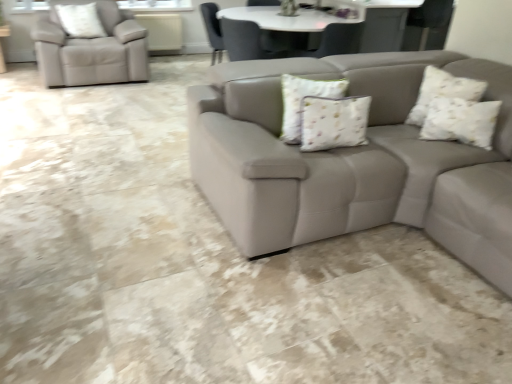
What do you see at coordinates (461, 121) in the screenshot?
I see `white textured pillow at upper right, acting as the 2th pillow starting from the front` at bounding box center [461, 121].

At what (x,y) coordinates should I click in order to perform the action: click on white floral fabric pillow at center, which is counted as the first pillow, starting from the bottom. Please return your answer as a coordinate pair (x, y). Looking at the image, I should click on (333, 122).

From the image's perspective, which one is positioned higher, white floral fabric pillow at center, positioned as the 3th pillow in top-to-bottom order, or white textured pillow at upper left, which appears as the third pillow when viewed from the front?

white textured pillow at upper left, which appears as the third pillow when viewed from the front, is shown above in the image.

Which of these two, white floral fabric pillow at center, which is counted as the first pillow, starting from the bottom, or white textured pillow at upper left, which appears as the third pillow when viewed from the front, stands shorter?

Result: With less height is white floral fabric pillow at center, which is counted as the first pillow, starting from the bottom.

Is white floral fabric pillow at center, which is the 3th pillow from back to front, smaller than white textured pillow at upper left, the 1th pillow from the back?

Indeed, white floral fabric pillow at center, which is the 3th pillow from back to front, has a smaller size compared to white textured pillow at upper left, the 1th pillow from the back.

Identify the location of pillow that is the 2nd object located in front of the white textured pillow at upper left, placed as the 3th pillow when sorted from right to left. (333, 122).

Is white floral fabric pillow at center, positioned as the second pillow in left-to-right order, completely or partially outside of white textured pillow at upper right, which is the first pillow from right to left?

white floral fabric pillow at center, positioned as the second pillow in left-to-right order, is positioned outside white textured pillow at upper right, which is the first pillow from right to left.

Is white floral fabric pillow at center, arranged as the 2th pillow when viewed from the right, to the left of white textured pillow at upper right, which appears as the second pillow when viewed from the top, from the viewer's perspective?

Yes.

Considering the sizes of objects white floral fabric pillow at center, positioned as the 3th pillow in top-to-bottom order, and white textured pillow at upper right, which is the first pillow from right to left, in the image provided, who is shorter, white floral fabric pillow at center, positioned as the 3th pillow in top-to-bottom order, or white textured pillow at upper right, which is the first pillow from right to left,?

white floral fabric pillow at center, positioned as the 3th pillow in top-to-bottom order, is shorter.

Is white textured pillow at upper right, positioned as the 2th pillow in back-to-front order, positioned with its back to white floral fabric pillow at center, which is counted as the first pillow, starting from the bottom?

No, white textured pillow at upper right, positioned as the 2th pillow in back-to-front order,'s orientation is not away from white floral fabric pillow at center, which is counted as the first pillow, starting from the bottom.

There is a white textured pillow at upper right, which appears as the second pillow when viewed from the top. In order to click on the 1st pillow above it (from a real-world perspective) in this screenshot , I will do `click(333, 122)`.

From a real-world perspective, is white textured pillow at upper right, which appears as the second pillow when viewed from the top, physically below white floral fabric pillow at center, positioned as the 3th pillow in top-to-bottom order?

Yes, from a real-world perspective, white textured pillow at upper right, which appears as the second pillow when viewed from the top, is below white floral fabric pillow at center, positioned as the 3th pillow in top-to-bottom order.

Can you confirm if white textured pillow at upper right, which is the 3th pillow in left-to-right order, is taller than white floral fabric pillow at center, arranged as the 2th pillow when viewed from the right?

Yes, white textured pillow at upper right, which is the 3th pillow in left-to-right order, is taller than white floral fabric pillow at center, arranged as the 2th pillow when viewed from the right.

This screenshot has width=512, height=384. Find the location of `pillow behind the white textured pillow at upper right, which appears as the second pillow when viewed from the top`. pillow behind the white textured pillow at upper right, which appears as the second pillow when viewed from the top is located at coordinates (81, 20).

Is point (100, 36) in front of point (488, 134)?

No, (100, 36) is behind (488, 134).

Considering the sizes of white textured pillow at upper left, the 3th pillow ordered from the bottom, and white textured pillow at upper right, positioned as the 2th pillow in back-to-front order, in the image, is white textured pillow at upper left, the 3th pillow ordered from the bottom, taller or shorter than white textured pillow at upper right, positioned as the 2th pillow in back-to-front order,?

In the image, white textured pillow at upper left, the 3th pillow ordered from the bottom, appears to be taller than white textured pillow at upper right, positioned as the 2th pillow in back-to-front order.

Considering the relative sizes of white textured pillow at upper left, which ranks as the first pillow in top-to-bottom order, and white floral fabric pillow at center, which is the 3th pillow from back to front, in the image provided, is white textured pillow at upper left, which ranks as the first pillow in top-to-bottom order, shorter than white floral fabric pillow at center, which is the 3th pillow from back to front,?

No, white textured pillow at upper left, which ranks as the first pillow in top-to-bottom order, is not shorter than white floral fabric pillow at center, which is the 3th pillow from back to front.

Is white textured pillow at upper left, which ranks as the first pillow in top-to-bottom order, far from white floral fabric pillow at center, positioned as the second pillow in left-to-right order?

Yes, white textured pillow at upper left, which ranks as the first pillow in top-to-bottom order, and white floral fabric pillow at center, positioned as the second pillow in left-to-right order, are located far from each other.

At what (x,y) coordinates should I click in order to perform the action: click on the 2nd pillow below the white textured pillow at upper left, the 1th pillow from the back (from the image's perspective). Please return your answer as a coordinate pair (x, y). The image size is (512, 384). Looking at the image, I should click on (333, 122).

From a real-world perspective, is white textured pillow at upper left, the 1th pillow from the back, positioned above or below white floral fabric pillow at center, positioned as the second pillow in left-to-right order?

Clearly, from a real-world perspective, white textured pillow at upper left, the 1th pillow from the back, is above white floral fabric pillow at center, positioned as the second pillow in left-to-right order.

Is white textured pillow at upper right, which is the first pillow from right to left, facing towards white textured pillow at upper left, placed as the 3th pillow when sorted from right to left?

No, white textured pillow at upper right, which is the first pillow from right to left, is not aimed at white textured pillow at upper left, placed as the 3th pillow when sorted from right to left.

Which is in front, point (492, 130) or point (96, 23)?

Positioned in front is point (492, 130).

Does white textured pillow at upper right, which is the first pillow from right to left, have a lesser width compared to white textured pillow at upper left, the 1th pillow from the back?

No.

The image size is (512, 384). In order to click on pillow on the left side of white floral fabric pillow at center, which is the 3th pillow from back to front in this screenshot , I will do `click(81, 20)`.

You are a GUI agent. You are given a task and a screenshot of the screen. Output one action in this format:
    pyautogui.click(x=<x>, y=<y>)
    Task: Click on the pillow below the white floral fabric pillow at center, positioned as the 3th pillow in top-to-bottom order (from a real-world perspective)
    The width and height of the screenshot is (512, 384).
    Given the screenshot: What is the action you would take?
    pyautogui.click(x=461, y=121)

From the image, which object appears to be nearer to white textured pillow at upper left, which ranks as the first pillow in top-to-bottom order, white floral fabric pillow at center, which is counted as the first pillow, starting from the bottom, or white textured pillow at upper right, which is the first pillow from right to left?

Based on the image, white floral fabric pillow at center, which is counted as the first pillow, starting from the bottom, appears to be nearer to white textured pillow at upper left, which ranks as the first pillow in top-to-bottom order.

Considering their positions, is white textured pillow at upper left, the 3th pillow ordered from the bottom, positioned closer to white textured pillow at upper right, which appears as the second pillow when viewed from the top, than white floral fabric pillow at center, positioned as the 3th pillow in top-to-bottom order?

white floral fabric pillow at center, positioned as the 3th pillow in top-to-bottom order, is closer to white textured pillow at upper right, which appears as the second pillow when viewed from the top.

Looking at this image, estimate the real-world distances between objects in this image. Which object is further from white textured pillow at upper right, which appears as the second pillow when viewed from the top, white floral fabric pillow at center, which is counted as the first pillow, starting from the bottom, or white textured pillow at upper left, which ranks as the first pillow in top-to-bottom order?

white textured pillow at upper left, which ranks as the first pillow in top-to-bottom order.

Looking at the image, which one is located further to white floral fabric pillow at center, positioned as the 3th pillow in top-to-bottom order, white textured pillow at upper right, the second pillow when ordered from bottom to top, or white textured pillow at upper left, marked as the first pillow in a left-to-right arrangement?

white textured pillow at upper left, marked as the first pillow in a left-to-right arrangement, is positioned further to the anchor white floral fabric pillow at center, positioned as the 3th pillow in top-to-bottom order.

From the image, which object appears to be nearer to white floral fabric pillow at center, which is the 3th pillow from back to front, white textured pillow at upper left, which ranks as the first pillow in top-to-bottom order, or white textured pillow at upper right, positioned as the 2th pillow in back-to-front order?

white textured pillow at upper right, positioned as the 2th pillow in back-to-front order, is closer to white floral fabric pillow at center, which is the 3th pillow from back to front.

Which object lies further to the anchor point white textured pillow at upper left, marked as the first pillow in a left-to-right arrangement, white textured pillow at upper right, the second pillow when ordered from bottom to top, or white floral fabric pillow at center, which is counted as the first pillow, starting from the bottom?

Among the two, white textured pillow at upper right, the second pillow when ordered from bottom to top, is located further to white textured pillow at upper left, marked as the first pillow in a left-to-right arrangement.

I want to click on pillow between white textured pillow at upper left, which ranks as the first pillow in top-to-bottom order, and white textured pillow at upper right, which is the first pillow from right to left, so click(333, 122).